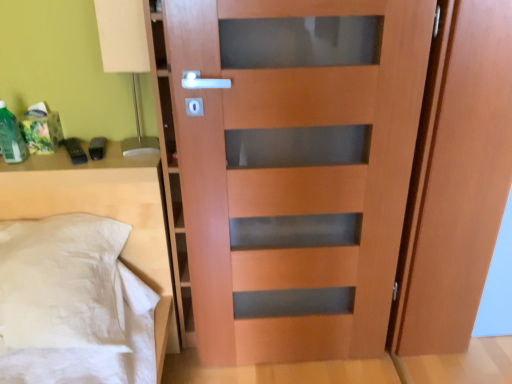
The image size is (512, 384). I want to click on white fabric pillow at left, so click(x=104, y=214).

This screenshot has width=512, height=384. Find the location of `green matte bottle at left`. green matte bottle at left is located at coordinates (11, 137).

The width and height of the screenshot is (512, 384). Describe the element at coordinates (126, 56) in the screenshot. I see `white matte table lamp at upper left` at that location.

This screenshot has width=512, height=384. I want to click on transparent glass door at right, so click(x=498, y=284).

Is white matte table lamp at upper left positioned with its back to matte wood screen door at right?

No, white matte table lamp at upper left is not facing away from matte wood screen door at right.

Could matte wood screen door at right be considered to be inside white matte table lamp at upper left?

Definitely not — matte wood screen door at right is not inside white matte table lamp at upper left.

Between white matte table lamp at upper left and matte wood screen door at right, which one has smaller size?

With smaller size is white matte table lamp at upper left.

In terms of height, does white matte table lamp at upper left look taller or shorter compared to matte wood screen door at right?

white matte table lamp at upper left is shorter than matte wood screen door at right.

What's the angular difference between matte wood door at center and white fabric pillow at left's facing directions?

1.4 degrees separate the facing orientations of matte wood door at center and white fabric pillow at left.

Consider the image. Which is nearer, [323,216] or [22,213]?

The point [323,216] is closer.

Is matte wood door at center to the left of white fabric pillow at left from the viewer's perspective?

No.

Is matte wood door at center turned away from white fabric pillow at left?

No, matte wood door at center is not facing away from white fabric pillow at left.

Which is in front, point (367, 193) or point (493, 268)?

The point (367, 193) is closer to the camera.

Is matte wood door at center outside of transparent glass door at right?

That's correct, matte wood door at center is outside of transparent glass door at right.

Is matte wood door at center turned away from transparent glass door at right?

No, transparent glass door at right is not at the back of matte wood door at center.

From a real-world perspective, which object stands above the other?

From a 3D spatial view, matte wood door at center is above.

Which is less distant, (498, 280) or (364, 98)?

Point (498, 280) is farther from the camera than point (364, 98).

Identify the location of door above the transparent glass door at right (from a real-world perspective). (296, 169).

Between transparent glass door at right and matte wood door at center, which one appears on the right side from the viewer's perspective?

Positioned to the right is transparent glass door at right.

From the image's perspective, is green matte bottle at left located above or below matte wood screen door at right?

Based on their image positions, green matte bottle at left is located above matte wood screen door at right.

Based on the photo, considering the relative sizes of green matte bottle at left and matte wood screen door at right in the image provided, is green matte bottle at left wider than matte wood screen door at right?

No, green matte bottle at left is not wider than matte wood screen door at right.

From a real-world perspective, is green matte bottle at left physically above matte wood screen door at right?

Yes, from a real-world perspective, green matte bottle at left is over matte wood screen door at right

Between point (134, 171) and point (477, 320), which one is positioned behind?

The point (477, 320) is more distant.

Is white fabric pillow at left located outside transparent glass door at right?

white fabric pillow at left lies outside transparent glass door at right's area.

From the image's perspective, between white fabric pillow at left and transparent glass door at right, who is located below?

transparent glass door at right appears lower in the image.

Looking at this image, would you say white fabric pillow at left is a long distance from transparent glass door at right?

Yes.

From the picture: Considering the positions of objects green matte bottle at left and white fabric pillow at left in the image provided, who is more to the left, green matte bottle at left or white fabric pillow at left?

Positioned to the left is green matte bottle at left.

Is green matte bottle at left positioned with its back to white fabric pillow at left?

That's not correct — green matte bottle at left is not looking away from white fabric pillow at left.

Can you tell me how much green matte bottle at left and white fabric pillow at left differ in facing direction?

There is a 4.57-degree angle between the facing directions of green matte bottle at left and white fabric pillow at left.

From the picture: From a real-world perspective, which object stands above the other?

green matte bottle at left is physically above.

Where is `table lamp lying on the left of matte wood screen door at right`? table lamp lying on the left of matte wood screen door at right is located at coordinates (126, 56).

Locate an element on the screen. Image resolution: width=512 pixels, height=384 pixels. door located above the white fabric pillow at left (from the image's perspective) is located at coordinates (296, 169).

From the image, which object appears to be farther from transparent glass door at right, white matte table lamp at upper left or green matte bottle at left?

Based on the image, green matte bottle at left appears to be further to transparent glass door at right.

Looking at the image, which one is located further to green matte bottle at left, matte wood screen door at right or white fabric pillow at left?

Among the two, matte wood screen door at right is located further to green matte bottle at left.

Which object lies nearer to the anchor point matte wood door at center, matte wood screen door at right or white fabric pillow at left?

The object closer to matte wood door at center is matte wood screen door at right.

When comparing their distances from transparent glass door at right, does matte wood door at center or white fabric pillow at left seem further?

Among the two, white fabric pillow at left is located further to transparent glass door at right.

Which object lies nearer to the anchor point transparent glass door at right, matte wood screen door at right or green matte bottle at left?

Based on the image, matte wood screen door at right appears to be nearer to transparent glass door at right.

Considering their positions, is white fabric pillow at left positioned closer to transparent glass door at right than white matte table lamp at upper left?

white fabric pillow at left lies closer to transparent glass door at right than the other object.

Looking at the image, which one is located closer to green matte bottle at left, matte wood door at center or white matte table lamp at upper left?

Based on the image, white matte table lamp at upper left appears to be nearer to green matte bottle at left.

Based on their spatial positions, is green matte bottle at left or white fabric pillow at left further from white matte table lamp at upper left?

Among the two, green matte bottle at left is located further to white matte table lamp at upper left.

You are a GUI agent. You are given a task and a screenshot of the screen. Output one action in this format:
    pyautogui.click(x=<x>, y=<y>)
    Task: Click on the table lamp between white fabric pillow at left and transparent glass door at right from left to right
    
    Given the screenshot: What is the action you would take?
    pyautogui.click(x=126, y=56)

The image size is (512, 384). In order to click on door between white matte table lamp at upper left and transparent glass door at right from left to right in this screenshot , I will do `click(296, 169)`.

This screenshot has height=384, width=512. I want to click on screen door between white matte table lamp at upper left and transparent glass door at right from left to right, so click(x=456, y=179).

Identify the location of table lamp situated between green matte bottle at left and transparent glass door at right from left to right. The height and width of the screenshot is (384, 512). (126, 56).